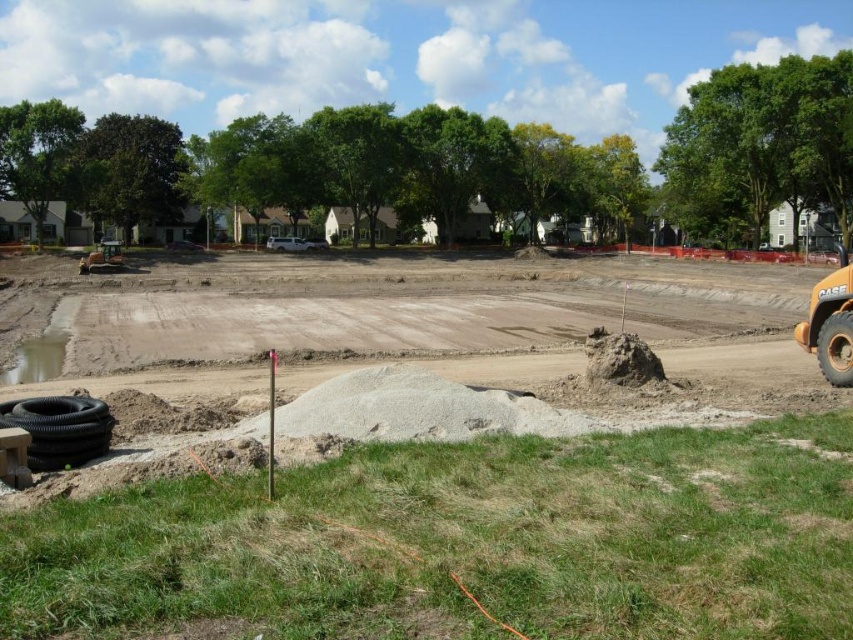
Can you confirm if black rubber tire at lower left is wider than yellow rubber excavator at right?

No.

Is black rubber tire at lower left to the right of yellow rubber excavator at right from the viewer's perspective?

In fact, black rubber tire at lower left is to the left of yellow rubber excavator at right.

The width and height of the screenshot is (853, 640). Describe the element at coordinates (61, 428) in the screenshot. I see `black rubber tire at lower left` at that location.

Locate an element on the screen. The width and height of the screenshot is (853, 640). black rubber tire at lower left is located at coordinates (61, 428).

From the picture: Which is above, yellow rubber excavator at right or rubber/textured tire at right?

yellow rubber excavator at right is higher up.

Is yellow rubber excavator at right to the right of rubber/textured tire at right from the viewer's perspective?

Correct, you'll find yellow rubber excavator at right to the right of rubber/textured tire at right.

This screenshot has height=640, width=853. Identify the location of yellow rubber excavator at right. (830, 323).

Locate an element on the screen. yellow rubber excavator at right is located at coordinates (830, 323).

Can you confirm if black rubber tire at lower left is positioned to the right of rubber/textured tire at right?

No, black rubber tire at lower left is not to the right of rubber/textured tire at right.

Where is `black rubber tire at lower left`? The height and width of the screenshot is (640, 853). black rubber tire at lower left is located at coordinates tap(61, 428).